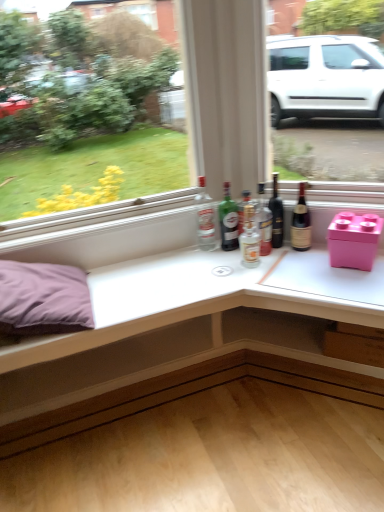
Question: Would you say translucent glass bottle at center, placed as the third bottle when sorted from right to left, is to the left or to the right of pink plastic storage box at right in the picture?

Choices:
 (A) left
 (B) right

Answer: (A)

Question: Considering their positions, is translucent glass bottle at center, placed as the third bottle when sorted from right to left, located in front of or behind pink plastic storage box at right?

Choices:
 (A) front
 (B) behind

Answer: (B)

Question: Considering the real-world distances, which object is farthest from the green glass bottle at center, which ranks as the 4th bottle in right-to-left order?

Choices:
 (A) pink plastic storage box at right
 (B) dark glass bottle at center
 (C) brown glass bottle at right, the 1th bottle viewed from the right
 (D) translucent glass bottle at center, the fourth bottle from the left
 (E) clear glass bottle at center, which is the first bottle in left-to-right order

Answer: (A)

Question: Which object is the closest to the translucent glass bottle at center, placed as the third bottle when sorted from right to left?

Choices:
 (A) clear glass bottle at center, which ranks as the 5th bottle in right-to-left order
 (B) pink plastic storage box at right
 (C) white glossy table at upper center
 (D) green glass bottle at center, which ranks as the 4th bottle in right-to-left order
 (E) brown glass bottle at right, arranged as the fifth bottle when viewed from the left

Answer: (D)